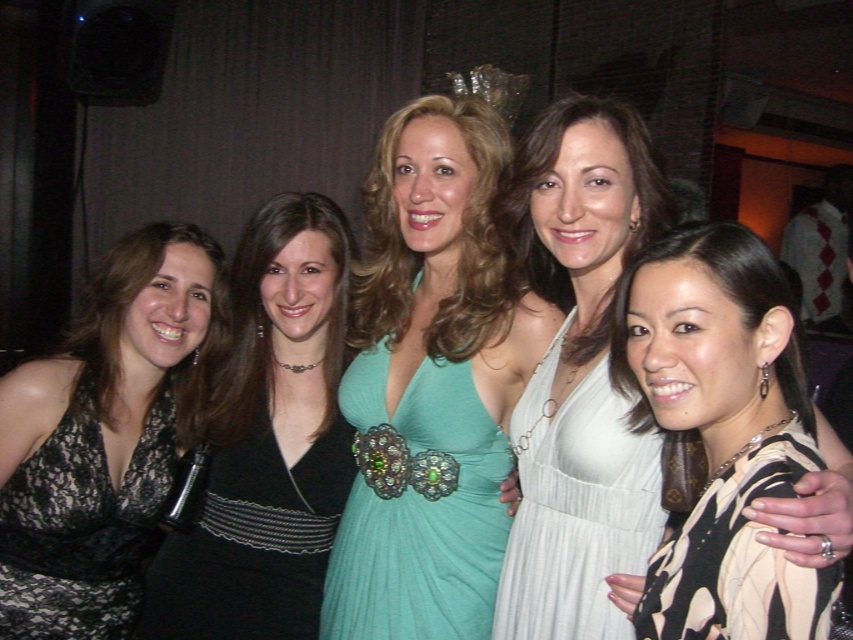
In the scene shown: You are a photographer at the event and need to adjust the lighting to ensure both the white satin dress at center and the lace fabric dress at left are well lit. Considering their sizes, which dress might require more space in the frame to avoid being cut off?

The white satin dress at center requires more space in the frame because its width is larger than the lace fabric dress at left, so it needs a wider area to be fully captured without being cut off.

You are a photographer at a party and want to ensure all five women are in frame. The teal satin dress at center is at point 0.602, 0.504. Where should you position your camera to capture everyone?

The teal satin dress at center is at point (428,385), so positioning the camera centrally would ensure all five women are in frame.